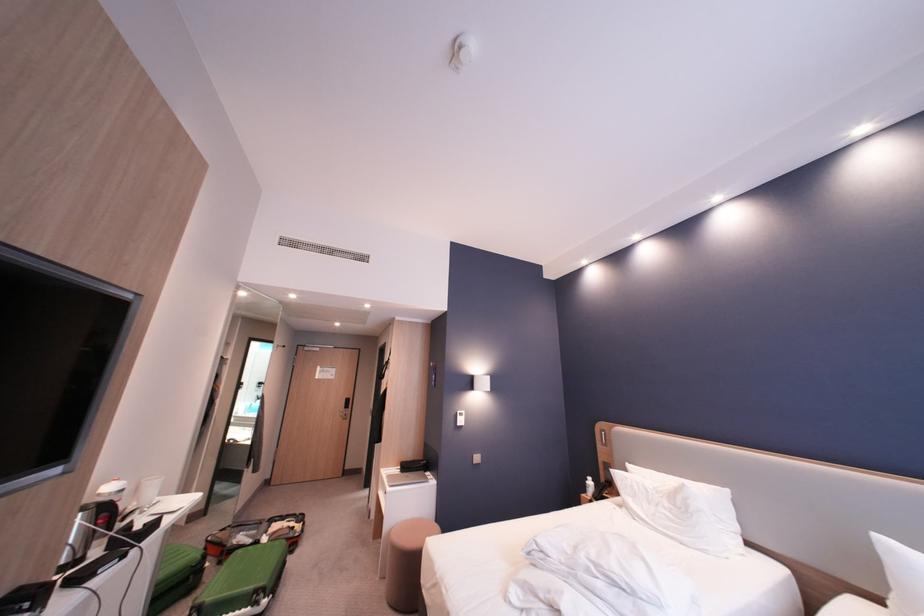
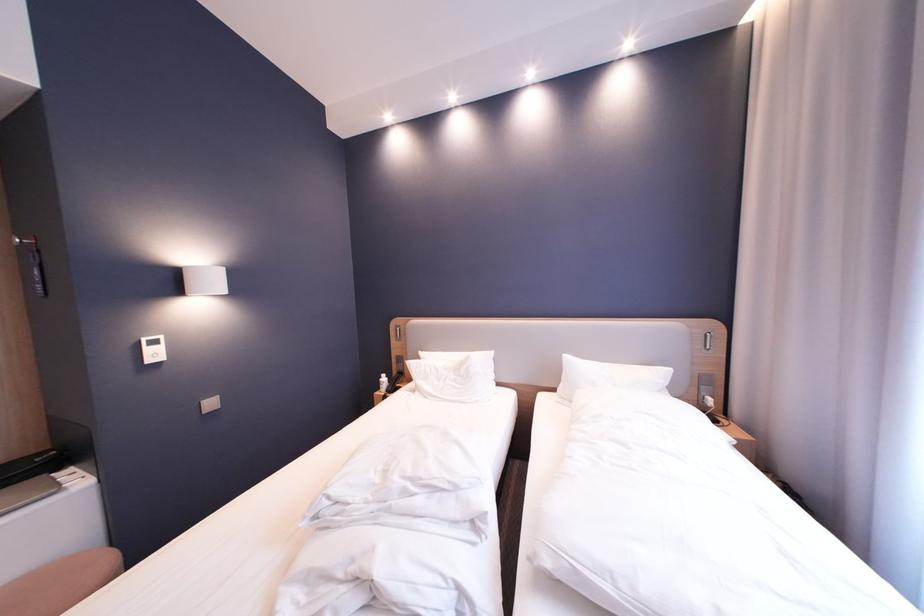
The point at (661, 505) is marked in the first image. Where is the corresponding point in the second image?

(450, 382)